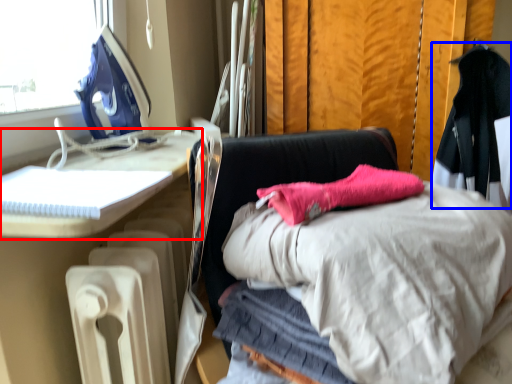
Question: Which point is closer to the camera, furniture (highlighted by a red box) or clothing (highlighted by a blue box)?

Choices:
 (A) furniture
 (B) clothing

Answer: (A)